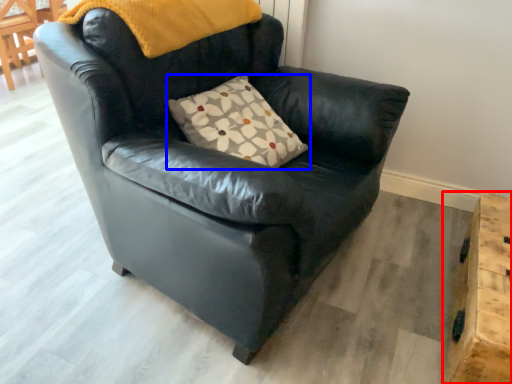
Question: Which object is closer to the camera taking this photo, table (highlighted by a red box) or pillow (highlighted by a blue box)?

Choices:
 (A) table
 (B) pillow

Answer: (A)